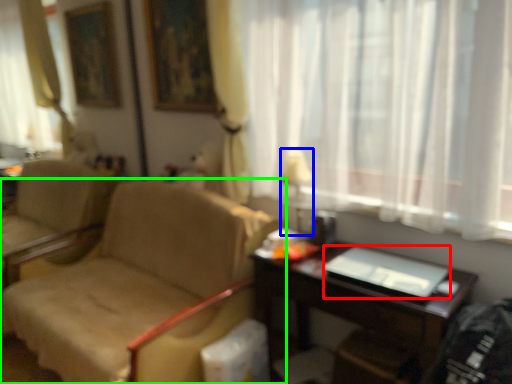
Question: Which object is the farthest from laptop (highlighted by a red box)? Choose among these: table lamp (highlighted by a blue box) or chair (highlighted by a green box).

Choices:
 (A) table lamp
 (B) chair

Answer: (B)